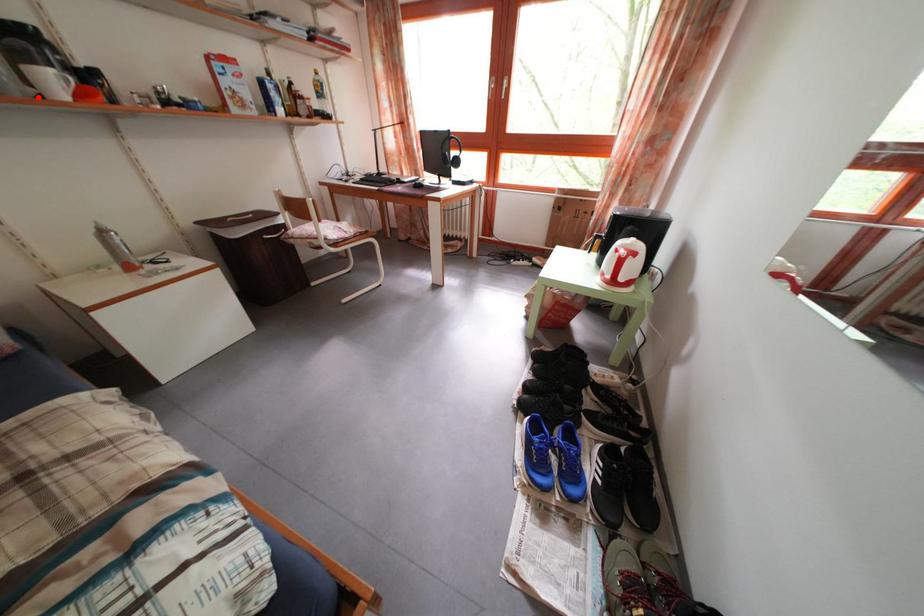
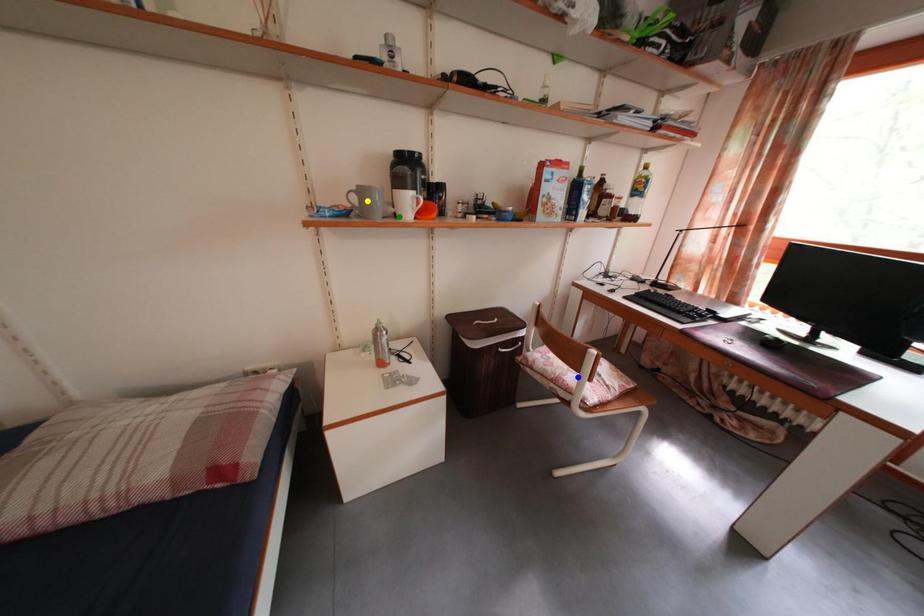
Question: I am providing you with two images of the same scene from different viewpoints. A red point is marked on the first image. You are given multiple points on the second image. In image 2, which mark is for the same physical point as the one in image 1?

Choices:
 (A) blue point
 (B) yellow point
 (C) green point

Answer: (C)